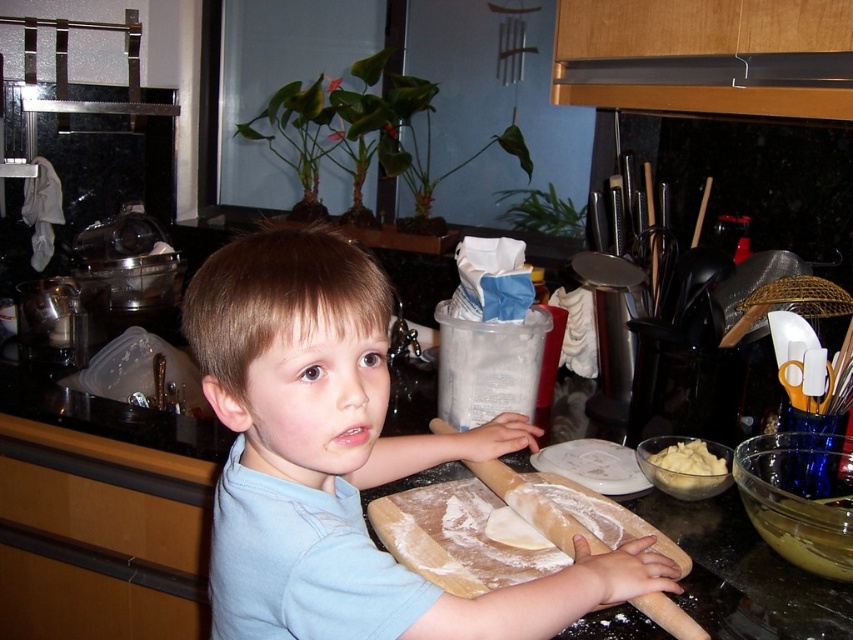
Question: Can you confirm if wooden rolling pin at center is positioned to the right of yellow creamy spread at center?

Choices:
 (A) no
 (B) yes

Answer: (A)

Question: Is light blue cotton shirt at center to the left of wooden rolling pin at center from the viewer's perspective?

Choices:
 (A) yes
 (B) no

Answer: (A)

Question: Which point is farther to the camera?

Choices:
 (A) (375, 378)
 (B) (506, 480)

Answer: (B)

Question: Based on their relative distances, which object is farther from the wooden rolling pin at center?

Choices:
 (A) yellow creamy spread at center
 (B) light blue cotton shirt at center

Answer: (A)

Question: Does light blue cotton shirt at center appear on the left side of wooden rolling pin at center?

Choices:
 (A) no
 (B) yes

Answer: (B)

Question: Which point appears closest to the camera in this image?

Choices:
 (A) (521, 481)
 (B) (686, 442)
 (C) (229, 584)

Answer: (C)